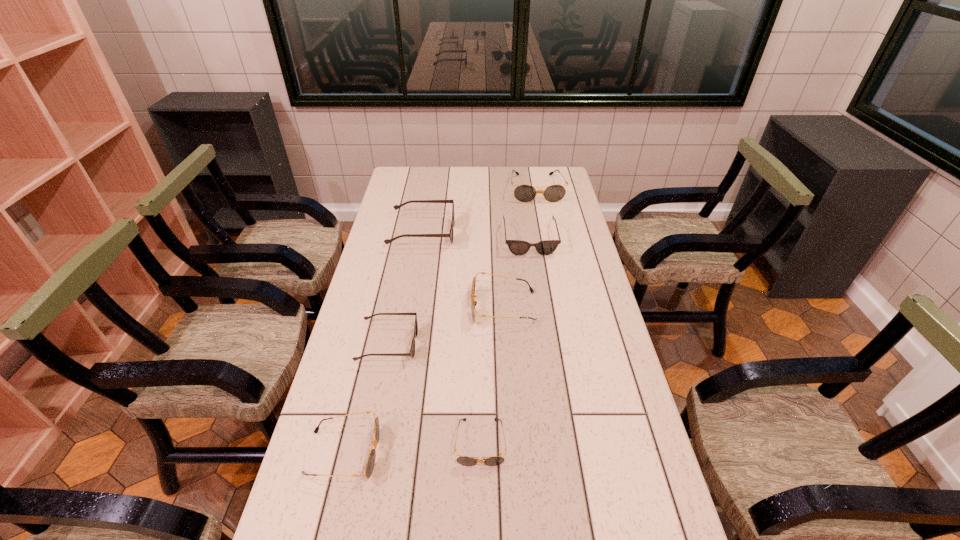
This screenshot has width=960, height=540. In order to click on vacant space at the far edge of the desktop in this screenshot , I will do `click(524, 177)`.

Find the location of a particular element. The image size is (960, 540). vacant space at the left edge of the desktop is located at coordinates (318, 453).

Identify the location of free space at the right edge. (602, 364).

The image size is (960, 540). In the image, there is a desktop. In order to click on vacant space at the far left corner in this screenshot , I will do point(421,170).

Locate an element on the screen. The image size is (960, 540). vacant space in between the leftmost black sunglasses and the shortest sunglasses is located at coordinates (412, 448).

What are the coordinates of `free spot between the leftmost black sunglasses and the shortest sunglasses` in the screenshot? It's located at (412, 448).

Where is `empty space between the third nearest black sunglasses and the leftmost black sunglasses`? The height and width of the screenshot is (540, 960). empty space between the third nearest black sunglasses and the leftmost black sunglasses is located at coordinates (423, 380).

Locate an element on the screen. The height and width of the screenshot is (540, 960). free point between the nearest brown sunglasses and the rightmost brown sunglasses is located at coordinates (459, 292).

This screenshot has width=960, height=540. Identify the location of free space between the rightmost brown sunglasses and the smallest brown sunglasses. (459, 292).

You are a GUI agent. You are given a task and a screenshot of the screen. Output one action in this format:
    pyautogui.click(x=<x>, y=<y>)
    Task: Click on the vacant space that is in between the nearest brown sunglasses and the rightmost brown sunglasses
    
    Given the screenshot: What is the action you would take?
    pyautogui.click(x=459, y=292)